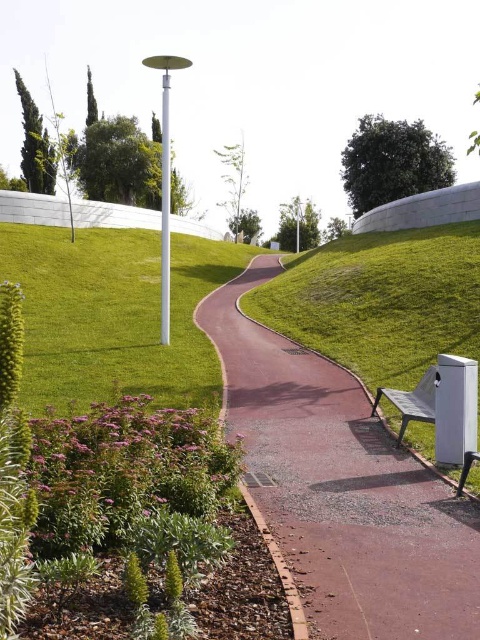
Is the position of pink rubber path at center more distant than that of metallic silver bench at lower right?

No, pink rubber path at center is in front of metallic silver bench at lower right.

Can you confirm if pink rubber path at center is shorter than metallic silver bench at lower right?

Incorrect, pink rubber path at center's height does not fall short of metallic silver bench at lower right's.

Between point (409, 576) and point (412, 410), which one is positioned in front?

Point (409, 576) is in front.

At what (x,y) coordinates should I click in order to perform the action: click on pink rubber path at center. Please return your answer as a coordinate pair (x, y). This screenshot has height=640, width=480. Looking at the image, I should click on (340, 486).

Is green grass at lower left below metallic silver bench at lower right?

Incorrect, green grass at lower left is not positioned below metallic silver bench at lower right.

Does point (33, 388) lie in front of point (408, 404)?

That is False.

Locate an element on the screen. green grass at lower left is located at coordinates (113, 314).

Does pink rubber path at center appear under green grass at lower left?

Indeed, pink rubber path at center is positioned under green grass at lower left.

Between point (236, 356) and point (0, 276), which one is positioned in front?

Point (236, 356)

This screenshot has width=480, height=640. Identify the location of pink rubber path at center. (340, 486).